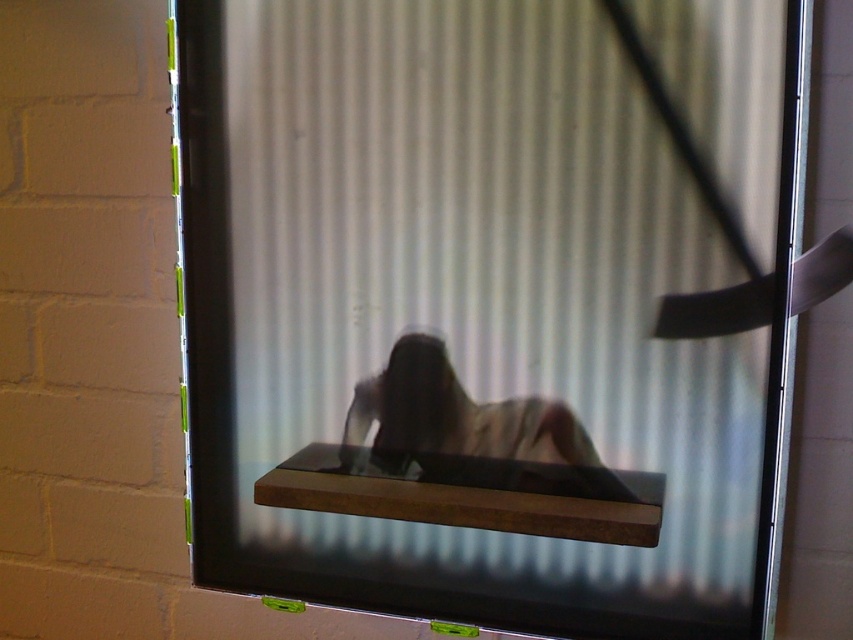
Question: Can you confirm if brown wood at center is positioned below light beige fabric at center?

Choices:
 (A) no
 (B) yes

Answer: (B)

Question: Among these points, which one is farthest from the camera?

Choices:
 (A) (440, 460)
 (B) (561, 460)

Answer: (A)

Question: Where is brown wood at center located in relation to light beige fabric at center in the image?

Choices:
 (A) above
 (B) below

Answer: (B)

Question: Does brown wood at center appear on the left side of light beige fabric at center?

Choices:
 (A) no
 (B) yes

Answer: (B)

Question: Which point appears closest to the camera in this image?

Choices:
 (A) (578, 428)
 (B) (270, 497)

Answer: (A)